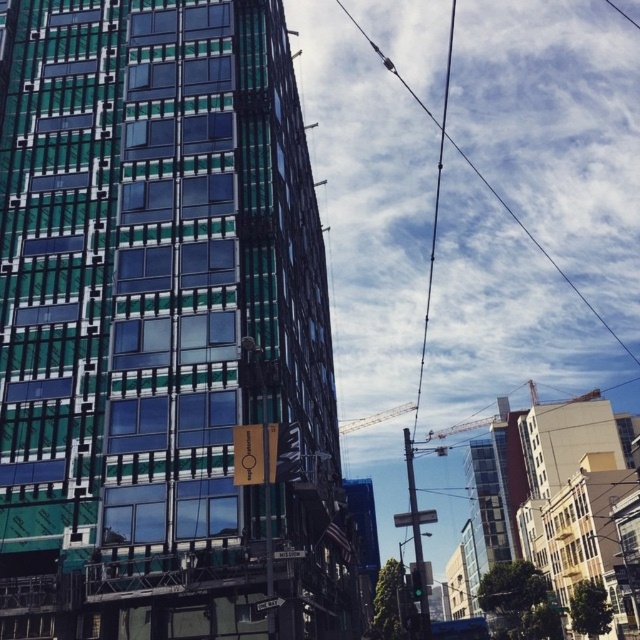
In the scene shown: You are standing on the sidewalk in front of the green glass building at center. You want to take a photo of it but need to be at least 100 feet away to capture the entire structure in one frame. Can you do this from your current position?

The green glass building at center is 104.64 feet away from viewer, so yes, you can take the photo from your current position since you are already beyond the 100 feet minimum distance required.

You are a drone operator trying to navigate between two points in the urban scene. You need to fly from point A to point B. Given that point A is at coordinate point(17, 476) and point B is at point(410, 518), which point is closer to the tall modern building with the green and blue facade?

Point(17, 476) is in front of point(410, 518), so it is closer to the tall modern building with the green and blue facade.